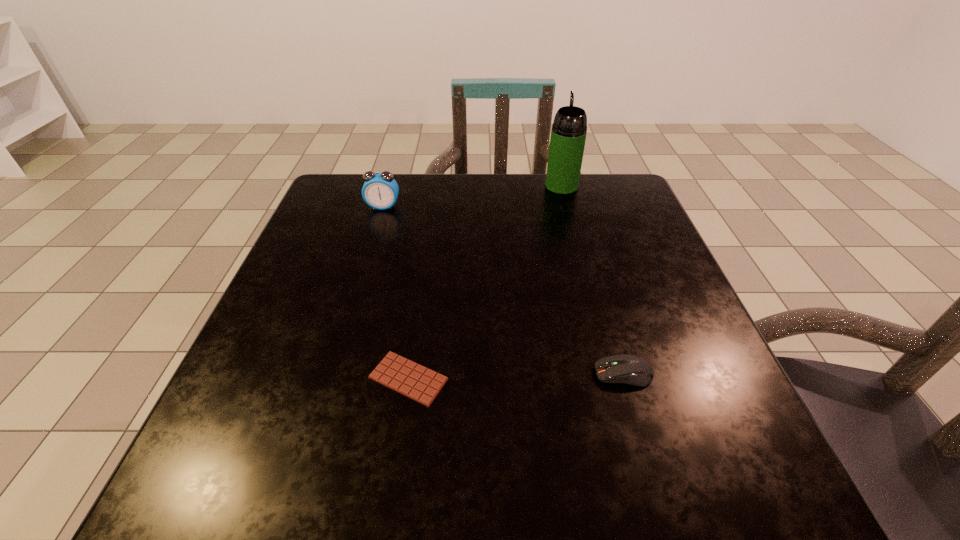
Identify the location of free space at the near edge. (550, 443).

Image resolution: width=960 pixels, height=540 pixels. I want to click on free space at the left edge of the desktop, so click(309, 325).

Identify the location of vacant area at the right edge. This screenshot has width=960, height=540. (636, 235).

Image resolution: width=960 pixels, height=540 pixels. In order to click on free location at the far left corner of the desktop in this screenshot , I will do `click(321, 202)`.

The image size is (960, 540). In the image, there is a desktop. Identify the location of vacant space at the near left corner. (306, 456).

Identify the location of vacant space at the far right corner. This screenshot has height=540, width=960. (605, 207).

Find the location of `blank region between the third shortest object and the shortest object`. blank region between the third shortest object and the shortest object is located at coordinates (396, 293).

At what (x,y) coordinates should I click in order to perform the action: click on free space between the computer equipment and the tallest object. Please return your answer as a coordinate pair (x, y). The image size is (960, 540). Looking at the image, I should click on (592, 280).

Where is `empty location between the leftmost object and the third tallest object`? The image size is (960, 540). empty location between the leftmost object and the third tallest object is located at coordinates (503, 290).

The width and height of the screenshot is (960, 540). What are the coordinates of `vacant point located between the second shortest object and the thermos bottle` in the screenshot? It's located at (592, 280).